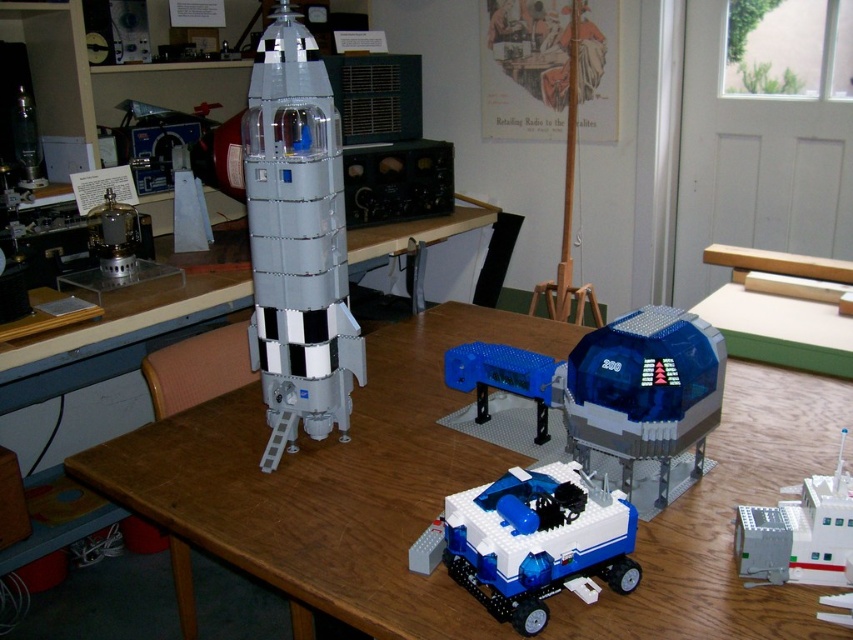
You are an astronaut preparing to explore the LEGO exhibit. You see the blue plastic rover at center and the blue plastic platform at center. Which object is shorter?

The blue plastic rover at center is shorter than the blue plastic platform at center.

You are a museum curator planning to move the translucent plastic rocket at center to a new display area. The new area has a shelf that can only accommodate items smaller than the wooden table at center. Will the rocket fit on the shelf?

The wooden table at center is larger in size than the translucent plastic rocket at center, so the rocket will fit on the shelf since it is smaller than the table.

You are standing in front of the LEGO exhibit and want to take a photo of the point at coordinate point [399,572]. If your camera has a maximum focus range of 1 meter, will it be able to focus on that point?

The distance between point [399,572] and the camera is 1.02 meters, which exceeds the camera maximum focus range of 1 meter. Therefore, the camera cannot focus on that point.